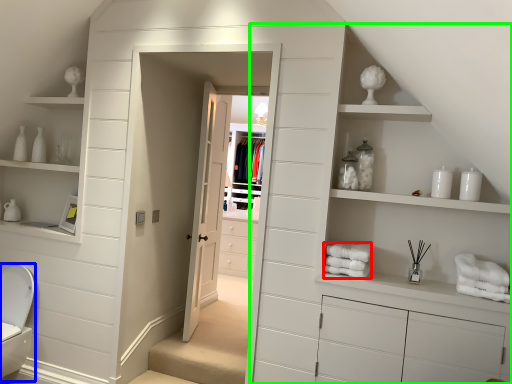
Question: Estimate the real-world distances between objects in this image. Which object is closer to bath towel (highlighted by a red box), toilet bowl (highlighted by a blue box) or dresser (highlighted by a green box)?

Choices:
 (A) toilet bowl
 (B) dresser

Answer: (B)